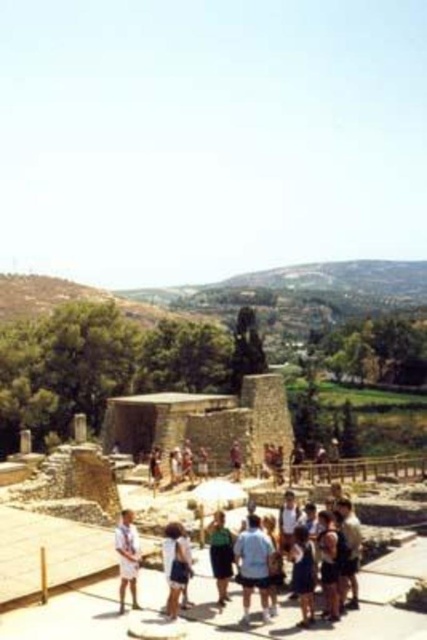
Measure the distance between light blue denim shorts at center and camera.

light blue denim shorts at center is 47.11 meters from camera.

Between point (254, 563) and point (123, 548), which one is positioned in front?

Point (254, 563) is in front.

Where is `light blue denim shorts at center`? The image size is (427, 640). light blue denim shorts at center is located at coordinates coord(254,564).

In order to click on white cotton shirt at center in this screenshot , I will do `click(175, 564)`.

Can you confirm if white cotton shirt at center is shorter than green fabric dress at center?

Yes, white cotton shirt at center is shorter than green fabric dress at center.

Between point (186, 554) and point (215, 538), which one is positioned behind?

Positioned behind is point (215, 538).

At what (x,y) coordinates should I click in order to perform the action: click on white cotton shirt at center. Please return your answer as a coordinate pair (x, y). The image size is (427, 640). Looking at the image, I should click on (175, 564).

Is white cotton shirt at center further to the viewer compared to white cotton shorts at lower center?

No, it is not.

Is point (178, 570) closer to camera compared to point (131, 522)?

Yes, point (178, 570) is closer to viewer.

Between point (178, 580) and point (123, 588), which one is positioned in front?

Point (178, 580) is more forward.

In order to click on white cotton shirt at center in this screenshot , I will do `click(175, 564)`.